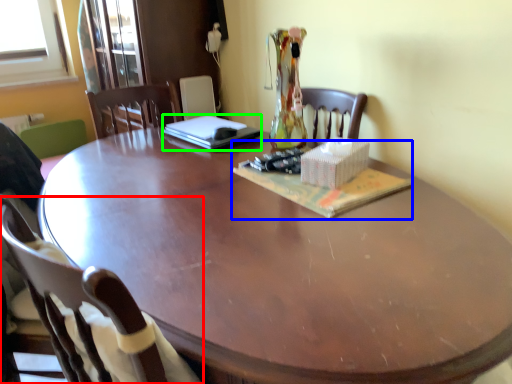
Question: Which object is positioned farthest from chair (highlighted by a red box)? Select from magazine (highlighted by a blue box) and laptop (highlighted by a green box).

Choices:
 (A) magazine
 (B) laptop

Answer: (B)